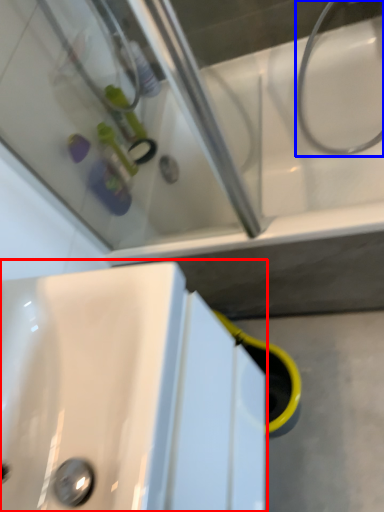
Question: Which object appears farthest to the camera in this image, sink (highlighted by a red box) or plumbing fixture (highlighted by a blue box)?

Choices:
 (A) sink
 (B) plumbing fixture

Answer: (B)